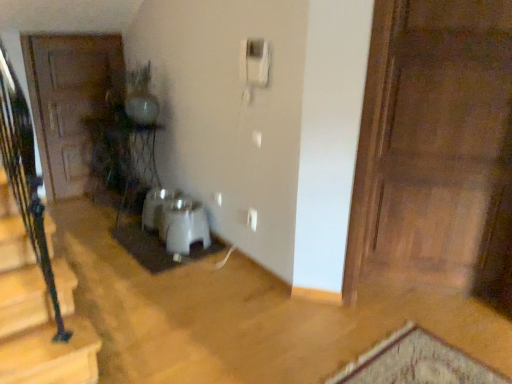
In order to face white plastic corded phone at upper center, should I rotate leftwards or rightwards?

To align with it, rotate left about 0.319°.

Where is `white matte doormat at center`? Image resolution: width=512 pixels, height=384 pixels. white matte doormat at center is located at coordinates (158, 247).

This screenshot has width=512, height=384. What do you see at coordinates (441, 145) in the screenshot?
I see `wooden door at right, acting as the second door starting from the back` at bounding box center [441, 145].

The height and width of the screenshot is (384, 512). I want to click on white plastic water heater at center, so click(x=182, y=225).

Does point (264, 65) appear closer or farther from the camera than point (193, 238)?

Point (264, 65).

Is white plastic corded phone at upper center far away from white plastic water heater at center?

No, there isn't a large distance between white plastic corded phone at upper center and white plastic water heater at center.

The height and width of the screenshot is (384, 512). What are the coordinates of `corded phone above the white plastic water heater at center (from the image's perspective)` in the screenshot? It's located at (254, 66).

Is white matte doormat at center aimed at white plastic corded phone at upper center?

No.

From a real-world perspective, is white matte doormat at center on top of white plastic corded phone at upper center?

No, from a real-world perspective, white matte doormat at center is not on top of white plastic corded phone at upper center.

Consider the image. From the image's perspective, who appears lower, white matte doormat at center or white plastic corded phone at upper center?

From the image's view, white matte doormat at center is below.

Consider the image. Who is shorter, white matte doormat at center or white plastic corded phone at upper center?

With less height is white matte doormat at center.

From the image's perspective, is wooden door at right, which is the 2th door in left-to-right order, located above or below wooden door at left, which ranks as the first door in back-to-front order?

Clearly, from the image's perspective, wooden door at right, which is the 2th door in left-to-right order, is below wooden door at left, which ranks as the first door in back-to-front order.

Identify the location of door that appears behind the wooden door at right, which is the 2th door in left-to-right order. The width and height of the screenshot is (512, 384). (68, 102).

Who is smaller, wooden door at right, acting as the 1th door starting from the right, or wooden door at left, arranged as the second door when viewed from the right?

wooden door at left, arranged as the second door when viewed from the right, is smaller.

Looking at this image, is wooden door at right, which ranks as the 1th door in front-to-back order, facing away from white plastic corded phone at upper center?

wooden door at right, which ranks as the 1th door in front-to-back order, is not turned away from white plastic corded phone at upper center.

Who is taller, wooden door at right, acting as the second door starting from the back, or white plastic corded phone at upper center?

wooden door at right, acting as the second door starting from the back, is taller.

How different are the orientations of wooden door at right, acting as the second door starting from the back, and white plastic corded phone at upper center in degrees?

The angular difference between wooden door at right, acting as the second door starting from the back, and white plastic corded phone at upper center is 38.3 degrees.

Which object is thinner, wooden door at right, which ranks as the 1th door in front-to-back order, or white plastic corded phone at upper center?

white plastic corded phone at upper center is thinner.

Is wooden door at left, which ranks as the first door in back-to-front order, outside of white plastic corded phone at upper center?

wooden door at left, which ranks as the first door in back-to-front order, is positioned outside white plastic corded phone at upper center.

Considering the relative sizes of wooden door at left, which ranks as the first door in back-to-front order, and white plastic corded phone at upper center in the image provided, is wooden door at left, which ranks as the first door in back-to-front order, wider than white plastic corded phone at upper center?

Incorrect, the width of wooden door at left, which ranks as the first door in back-to-front order, does not surpass that of white plastic corded phone at upper center.

Find the location of a particular element. The height and width of the screenshot is (384, 512). corded phone that appears in front of the wooden door at left, which ranks as the first door in left-to-right order is located at coordinates (254, 66).

From the image's perspective, is wooden door at left, which is the 2th door from front to back, positioned above or below white plastic corded phone at upper center?

From the image's perspective, wooden door at left, which is the 2th door from front to back, appears below white plastic corded phone at upper center.

Can you confirm if white plastic corded phone at upper center is smaller than wooden door at left, which ranks as the first door in back-to-front order?

Yes.

Considering the relative sizes of white plastic corded phone at upper center and wooden door at left, which ranks as the first door in left-to-right order, in the image provided, is white plastic corded phone at upper center wider than wooden door at left, which ranks as the first door in left-to-right order,?

Correct, the width of white plastic corded phone at upper center exceeds that of wooden door at left, which ranks as the first door in left-to-right order.

Can you tell me how much white plastic corded phone at upper center and wooden door at left, which is the 2th door from front to back, differ in facing direction?

89.1 degrees separate the facing orientations of white plastic corded phone at upper center and wooden door at left, which is the 2th door from front to back.

From a real-world perspective, which object rests below the other?

wooden door at left, which is the 2th door from front to back, from a real-world perspective.

Considering the positions of point (69, 108) and point (197, 222), is point (69, 108) closer or farther from the camera than point (197, 222)?

Clearly, point (69, 108) is more distant from the camera than point (197, 222).

Considering the sizes of wooden door at left, which is the 2th door from front to back, and white plastic water heater at center in the image, is wooden door at left, which is the 2th door from front to back, bigger or smaller than white plastic water heater at center?

In the image, wooden door at left, which is the 2th door from front to back, appears to be larger than white plastic water heater at center.

From the picture: Are wooden door at left, arranged as the second door when viewed from the right, and white plastic water heater at center beside each other?

wooden door at left, arranged as the second door when viewed from the right, is not next to white plastic water heater at center, and they're not touching.

Is wooden door at left, arranged as the second door when viewed from the right, looking in the opposite direction of white plastic water heater at center?

wooden door at left, arranged as the second door when viewed from the right, is not turned away from white plastic water heater at center.

The image size is (512, 384). In order to click on water heater located underneath the white plastic corded phone at upper center (from a real-world perspective) in this screenshot , I will do `click(182, 225)`.

Image resolution: width=512 pixels, height=384 pixels. I want to click on corded phone that is above the white matte doormat at center (from the image's perspective), so click(254, 66).

Estimate the real-world distances between objects in this image. Which object is further from white matte doormat at center, white plastic water heater at center or white plastic corded phone at upper center?

white plastic corded phone at upper center.

From the image, which object appears to be nearer to wooden door at left, which is the 2th door from front to back, white plastic corded phone at upper center or white plastic water heater at center?

white plastic water heater at center is positioned closer to the anchor wooden door at left, which is the 2th door from front to back.

Based on their spatial positions, is white plastic corded phone at upper center or wooden door at left, arranged as the second door when viewed from the right, closer to white plastic water heater at center?

white plastic corded phone at upper center is closer to white plastic water heater at center.

When comparing their distances from wooden door at left, which is the 2th door from front to back, does wooden door at right, acting as the second door starting from the back, or white matte doormat at center seem closer?

white matte doormat at center lies closer to wooden door at left, which is the 2th door from front to back, than the other object.

Considering their positions, is white matte doormat at center positioned further to white plastic corded phone at upper center than wooden door at left, which is the 2th door from front to back?

wooden door at left, which is the 2th door from front to back.

From the image, which object appears to be nearer to white matte doormat at center, wooden door at right, which is the 2th door in left-to-right order, or white plastic water heater at center?

The object closer to white matte doormat at center is white plastic water heater at center.

Based on their spatial positions, is wooden door at left, which ranks as the first door in back-to-front order, or wooden door at right, which is the 2th door in left-to-right order, closer to white matte doormat at center?

wooden door at left, which ranks as the first door in back-to-front order, is closer to white matte doormat at center.

Which object lies further to the anchor point wooden door at left, which ranks as the first door in back-to-front order, white matte doormat at center or white plastic corded phone at upper center?

Based on the image, white plastic corded phone at upper center appears to be further to wooden door at left, which ranks as the first door in back-to-front order.

I want to click on doormat located between wooden door at left, which ranks as the first door in back-to-front order, and wooden door at right, acting as the second door starting from the back, in the left-right direction, so click(x=158, y=247).

Identify the location of corded phone between white matte doormat at center and wooden door at right, acting as the 1th door starting from the right. pos(254,66).

The height and width of the screenshot is (384, 512). Identify the location of water heater between wooden door at left, arranged as the second door when viewed from the right, and white plastic corded phone at upper center, in the horizontal direction. (182, 225).

You are a GUI agent. You are given a task and a screenshot of the screen. Output one action in this format:
    pyautogui.click(x=<x>, y=<y>)
    Task: Click on the doormat between wooden door at left, arranged as the second door when viewed from the right, and white plastic corded phone at upper center from left to right
    This screenshot has height=384, width=512.
    Given the screenshot: What is the action you would take?
    pyautogui.click(x=158, y=247)